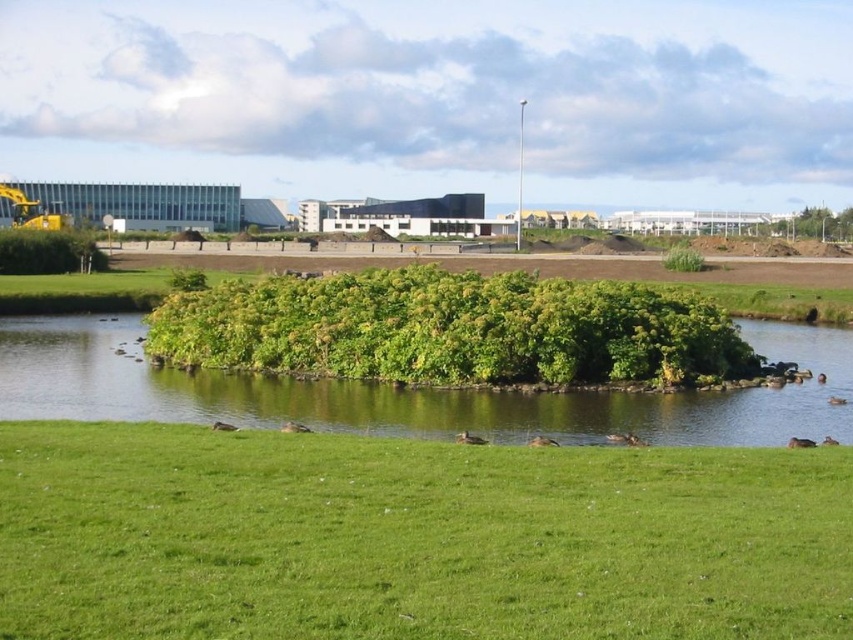
Between green leafy bush at center and brown feathered duck at lower center, which one has more height?

green leafy bush at center

The image size is (853, 640). Identify the location of green leafy bush at center. (451, 330).

Is point (421, 333) behind point (537, 436)?

Yes.

I want to click on green leafy bush at center, so click(451, 330).

Is green grassy at lower center to the left of brown fuzzy duck at lower center from the viewer's perspective?

No, green grassy at lower center is not to the left of brown fuzzy duck at lower center.

Which is behind, point (506, 538) or point (469, 440)?

The point (469, 440) is behind.

Which is behind, point (656, 554) or point (477, 442)?

Positioned behind is point (477, 442).

The width and height of the screenshot is (853, 640). In order to click on green grassy at lower center in this screenshot , I will do `click(413, 538)`.

Which is above, green leafy bush at upper right or brown fuzzy duck at lower center?

green leafy bush at upper right is above.

Which is below, green leafy bush at upper right or brown fuzzy duck at lower center?

brown fuzzy duck at lower center is lower down.

Which is behind, point (814, 209) or point (457, 442)?

Positioned behind is point (814, 209).

Identify the location of green leafy bush at upper right. The image size is (853, 640). (811, 225).